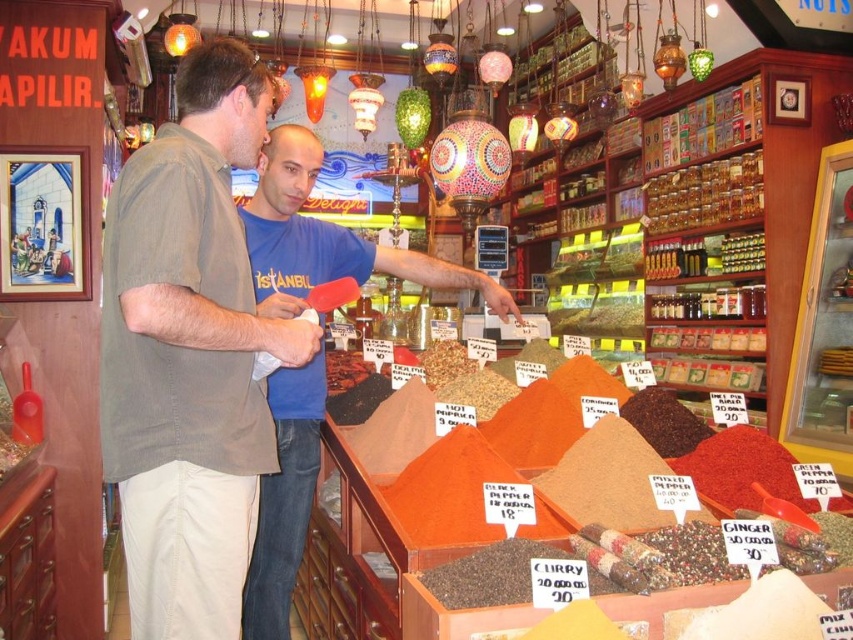
Question: In this image, where is light brown cotton shirt at center located relative to blue t-shirt at center?

Choices:
 (A) above
 (B) below

Answer: (A)

Question: Does light brown cotton shirt at center appear under blue t-shirt at center?

Choices:
 (A) no
 (B) yes

Answer: (A)

Question: Can you confirm if light brown cotton shirt at center is bigger than blue t-shirt at center?

Choices:
 (A) no
 (B) yes

Answer: (A)

Question: Among these objects, which one is nearest to the camera?

Choices:
 (A) blue t-shirt at center
 (B) light brown cotton shirt at center

Answer: (B)

Question: Which point appears farthest from the camera in this image?

Choices:
 (A) (285, 177)
 (B) (267, 442)

Answer: (A)